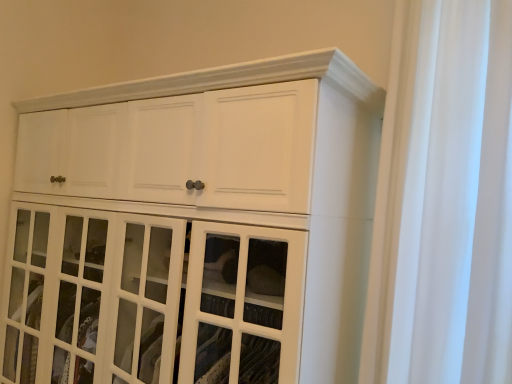
Describe the element at coordinates (194, 227) in the screenshot. I see `white glossy cabinet at upper center` at that location.

Identify the location of white glossy cabinet at upper center. (194, 227).

The height and width of the screenshot is (384, 512). What are the coordinates of `white glossy cabinet at upper center` in the screenshot? It's located at (194, 227).